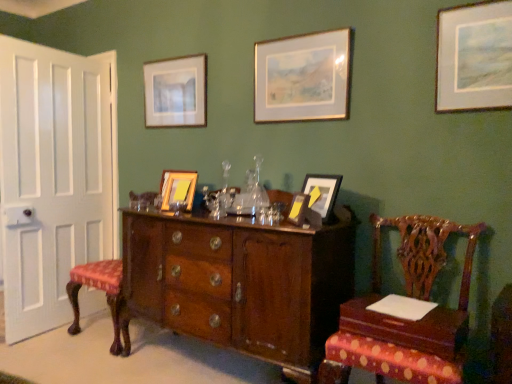
Find the location of `wooden picture frame at center, placed as the fifth picture frame when sorted from front to back`. wooden picture frame at center, placed as the fifth picture frame when sorted from front to back is located at coordinates (178, 189).

Image resolution: width=512 pixels, height=384 pixels. What do you see at coordinates (298, 209) in the screenshot?
I see `matte gold picture frame at center, which is the 4th picture frame in right-to-left order` at bounding box center [298, 209].

This screenshot has height=384, width=512. In order to click on polished wood cabinet at center in this screenshot , I will do `click(240, 283)`.

Does point (145, 126) appear closer or farther from the camera than point (170, 192)?

Point (145, 126) appears to be farther away from the viewer than point (170, 192).

I want to click on picture frame that is the 3rd object located above the wooden picture frame at center, placed as the fifth picture frame when sorted from front to back (from the image's perspective), so click(176, 92).

Can we say matte wooden picture frame at upper center, which ranks as the first picture frame in back-to-front order, lies outside wooden picture frame at center, the 2th picture frame from the left?

Indeed, matte wooden picture frame at upper center, which ranks as the first picture frame in back-to-front order, is completely outside wooden picture frame at center, the 2th picture frame from the left.

Is matte wooden picture frame at upper center, which ranks as the first picture frame in back-to-front order, next to wooden picture frame at center, placed as the fifth picture frame when sorted from front to back?

matte wooden picture frame at upper center, which ranks as the first picture frame in back-to-front order, and wooden picture frame at center, placed as the fifth picture frame when sorted from front to back, are not in contact.

Can you confirm if wooden chair with upholstered seat at left, which is the 1th chair in back-to-front order, is positioned to the right of matte wooden picture frame at upper center, which ranks as the first picture frame in back-to-front order?

No, wooden chair with upholstered seat at left, which is the 1th chair in back-to-front order, is not to the right of matte wooden picture frame at upper center, which ranks as the first picture frame in back-to-front order.

Is the position of wooden chair with upholstered seat at left, marked as the second chair in a right-to-left arrangement, more distant than that of matte wooden picture frame at upper center, marked as the 6th picture frame in a right-to-left arrangement?

No, wooden chair with upholstered seat at left, marked as the second chair in a right-to-left arrangement, is closer to the viewer.

Identify the location of the 1st chair in front of the matte wooden picture frame at upper center, which ranks as the first picture frame in back-to-front order. (106, 296).

Is wooden chair with upholstered seat at left, which is the 1th chair in back-to-front order, not inside matte wooden picture frame at upper center, acting as the 6th picture frame starting from the front?

wooden chair with upholstered seat at left, which is the 1th chair in back-to-front order, lies outside matte wooden picture frame at upper center, acting as the 6th picture frame starting from the front,'s area.

Considering the relative sizes of white wood door at left and wooden chair with upholstered seat at left, which is the 1th chair in back-to-front order, in the image provided, is white wood door at left smaller than wooden chair with upholstered seat at left, which is the 1th chair in back-to-front order,?

Indeed, white wood door at left has a smaller size compared to wooden chair with upholstered seat at left, which is the 1th chair in back-to-front order.

Which is behind, white wood door at left or wooden chair with upholstered seat at left, which is the 1th chair in back-to-front order?

Positioned behind is white wood door at left.

In the scene shown: What's the angular difference between white wood door at left and wooden chair with upholstered seat at left, which is the 1th chair in back-to-front order,'s facing directions?

They differ by 81.9 degrees in their facing directions.

From the image's perspective, which one is positioned lower, wooden table at lower right or polished wood cabinet at center?

From the image's view, polished wood cabinet at center is below.

You are a GUI agent. You are given a task and a screenshot of the screen. Output one action in this format:
    pyautogui.click(x=<x>, y=<y>)
    Task: Click on the table lying on the right of polished wood cabinet at center
    This screenshot has height=384, width=512.
    Given the screenshot: What is the action you would take?
    pyautogui.click(x=408, y=327)

Would you consider wooden table at lower right to be distant from polished wood cabinet at center?

Actually, wooden table at lower right and polished wood cabinet at center are a little close together.

Is wooden table at lower right completely or partially outside of polished wood cabinet at center?

Yes.

Does polished wood chair at right, which is the 1th chair from right to left, come behind polished wood cabinet at center?

No, it is not.

Between polished wood chair at right, placed as the second chair when sorted from back to front, and polished wood cabinet at center, which one has smaller size?

polished wood chair at right, placed as the second chair when sorted from back to front, is smaller.

From the image's perspective, which is above, polished wood chair at right, placed as the second chair when sorted from back to front, or polished wood cabinet at center?

From the image's view, polished wood cabinet at center is above.

From a real-world perspective, is polished wood chair at right, placed as the second chair when sorted from back to front, physically below polished wood cabinet at center?

No, from a real-world perspective, polished wood chair at right, placed as the second chair when sorted from back to front, is not below polished wood cabinet at center.

How distant is matte gray picture frame at upper right, which is the 6th picture frame from left to right, from matte brown picture frame at center, the 2th picture frame in the right-to-left sequence?

matte gray picture frame at upper right, which is the 6th picture frame from left to right, is 31.35 inches away from matte brown picture frame at center, the 2th picture frame in the right-to-left sequence.

Considering the relative positions of matte gray picture frame at upper right, placed as the first picture frame when sorted from front to back, and matte brown picture frame at center, which is the third picture frame in front-to-back order, in the image provided, is matte gray picture frame at upper right, placed as the first picture frame when sorted from front to back, to the right of matte brown picture frame at center, which is the third picture frame in front-to-back order, from the viewer's perspective?

Correct, you'll find matte gray picture frame at upper right, placed as the first picture frame when sorted from front to back, to the right of matte brown picture frame at center, which is the third picture frame in front-to-back order.

Relative to matte brown picture frame at center, the 2th picture frame in the right-to-left sequence, is matte gray picture frame at upper right, which appears as the 1th picture frame when viewed from the right, in front or behind?

matte gray picture frame at upper right, which appears as the 1th picture frame when viewed from the right, is positioned closer to the viewer than matte brown picture frame at center, the 2th picture frame in the right-to-left sequence.

Who is shorter, matte gray picture frame at upper right, which is the 6th picture frame from left to right, or matte brown picture frame at center, which is the fourth picture frame in back-to-front order?

With less height is matte brown picture frame at center, which is the fourth picture frame in back-to-front order.

Is the surface of wooden picture frame at center, the second picture frame from the back, in direct contact with white wood door at left?

No, wooden picture frame at center, the second picture frame from the back, is not making contact with white wood door at left.

Consider the image. Does wooden picture frame at center, placed as the fifth picture frame when sorted from front to back, appear on the right side of white wood door at left?

Yes.

Which is closer to the camera, (186, 200) or (70, 233)?

Point (186, 200) is positioned closer to the camera compared to point (70, 233).

Locate an element on the screen. Image resolution: width=512 pixels, height=384 pixels. picture frame that is the 2nd one when counting rightward from the white wood door at left is located at coordinates (178, 189).

Find the location of a particular element. the 1st picture frame located beneath the matte wooden picture frame at upper center, marked as the 6th picture frame in a right-to-left arrangement (from a real-world perspective) is located at coordinates (178, 189).

At what (x,y) coordinates should I click in order to perform the action: click on picture frame that is the 6th object located above the wooden chair with upholstered seat at left, the 1th chair when ordered from left to right (from the image's perspective). Please return your answer as a coordinate pair (x, y). The height and width of the screenshot is (384, 512). Looking at the image, I should click on (176, 92).

Considering their positions, is wooden table at lower right positioned closer to matte wooden picture frame at upper center, which ranks as the first picture frame in back-to-front order, than matte brown picture frame at center, which is the fourth picture frame in back-to-front order?

Based on the image, matte brown picture frame at center, which is the fourth picture frame in back-to-front order, appears to be nearer to matte wooden picture frame at upper center, which ranks as the first picture frame in back-to-front order.

Based on the photo, from the image, which object appears to be nearer to wooden table at lower right, white wood door at left or polished wood cabinet at center?

polished wood cabinet at center lies closer to wooden table at lower right than the other object.

When comparing their distances from polished wood chair at right, positioned as the first chair in front-to-back order, does matte gray picture frame at upper right, placed as the first picture frame when sorted from front to back, or matte brown picture frame at center, the 2th picture frame in the right-to-left sequence, seem further?

The object further to polished wood chair at right, positioned as the first chair in front-to-back order, is matte gray picture frame at upper right, placed as the first picture frame when sorted from front to back.

From the image, which object appears to be nearer to matte gray picture frame at upper right, the sixth picture frame in the back-to-front sequence, white wood door at left or gold-framed picture at upper center, marked as the 3th picture frame in a right-to-left arrangement?

gold-framed picture at upper center, marked as the 3th picture frame in a right-to-left arrangement, is positioned closer to the anchor matte gray picture frame at upper right, the sixth picture frame in the back-to-front sequence.

When comparing their distances from matte brown picture frame at center, which is the third picture frame in front-to-back order, does matte wooden picture frame at upper center, the 1th picture frame positioned from the left, or gold-framed picture at upper center, which is counted as the fourth picture frame, starting from the front, seem closer?

Based on the image, gold-framed picture at upper center, which is counted as the fourth picture frame, starting from the front, appears to be nearer to matte brown picture frame at center, which is the third picture frame in front-to-back order.

Which object lies further to the anchor point polished wood chair at right, placed as the second chair when sorted from back to front, matte brown picture frame at center, the 2th picture frame in the right-to-left sequence, or wooden chair with upholstered seat at left, the 1th chair when ordered from left to right?

wooden chair with upholstered seat at left, the 1th chair when ordered from left to right, is further to polished wood chair at right, placed as the second chair when sorted from back to front.

When comparing their distances from matte gray picture frame at upper right, which appears as the 1th picture frame when viewed from the right, does polished wood chair at right, which is the 1th chair from right to left, or matte gold picture frame at center, which is the 4th picture frame in right-to-left order, seem closer?

The object closer to matte gray picture frame at upper right, which appears as the 1th picture frame when viewed from the right, is polished wood chair at right, which is the 1th chair from right to left.

Estimate the real-world distances between objects in this image. Which object is further from matte wooden picture frame at upper center, the 1th picture frame positioned from the left, matte gray picture frame at upper right, placed as the first picture frame when sorted from front to back, or white wood door at left?

The object further to matte wooden picture frame at upper center, the 1th picture frame positioned from the left, is matte gray picture frame at upper right, placed as the first picture frame when sorted from front to back.

The width and height of the screenshot is (512, 384). Identify the location of cabinetry between gold-framed picture at upper center, which is counted as the fourth picture frame, starting from the front, and polished wood chair at right, acting as the 2th chair starting from the left, from top to bottom. click(240, 283).

Find the location of a particular element. The width and height of the screenshot is (512, 384). cabinetry between white wood door at left and matte gold picture frame at center, which is the 4th picture frame in right-to-left order is located at coordinates (240, 283).

At what (x,y) coordinates should I click in order to perform the action: click on picture frame situated between white wood door at left and wooden picture frame at center, placed as the fifth picture frame when sorted from front to back, from left to right. Please return your answer as a coordinate pair (x, y). The width and height of the screenshot is (512, 384). Looking at the image, I should click on (176, 92).

The width and height of the screenshot is (512, 384). What are the coordinates of `chair located between matte wooden picture frame at upper center, the 1th picture frame positioned from the left, and matte gray picture frame at upper right, the sixth picture frame in the back-to-front sequence, in the left-right direction` in the screenshot? It's located at (406, 320).